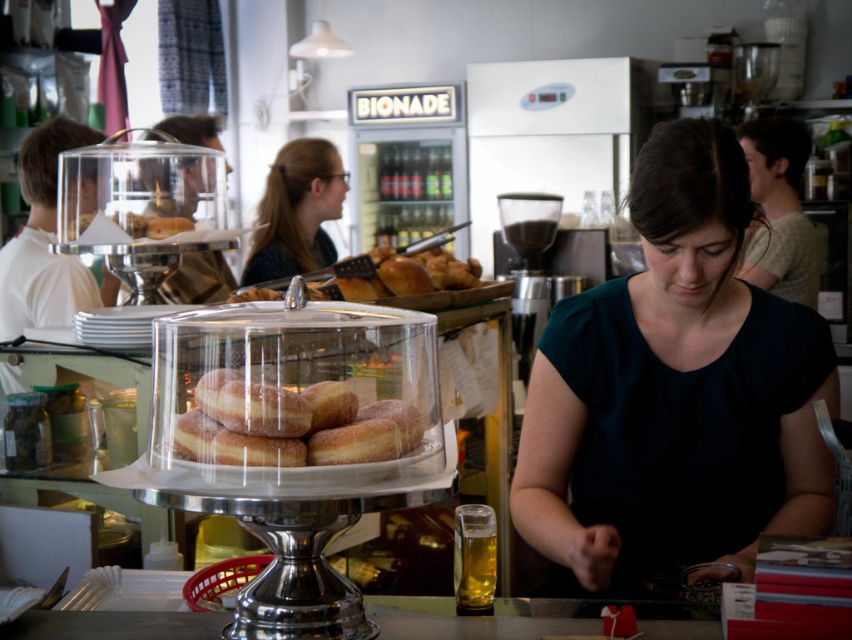
Question: Is dark green blouse at center below matte black shirt at center?

Choices:
 (A) no
 (B) yes

Answer: (B)

Question: Which object is positioned farthest from the sugared doughnut at center?

Choices:
 (A) light beige shirt at upper right
 (B) sugared doughnuts at center

Answer: (A)

Question: Does sugared doughnuts at center have a greater width compared to light beige shirt at upper right?

Choices:
 (A) no
 (B) yes

Answer: (A)

Question: Which of the following is the farthest from the observer?

Choices:
 (A) (389, 438)
 (B) (325, 243)

Answer: (B)

Question: Is the position of matte black shirt at center less distant than that of sugared doughnut at center?

Choices:
 (A) no
 (B) yes

Answer: (A)

Question: Which point is farther from the camera taking this photo?

Choices:
 (A) (366, 432)
 (B) (671, 440)
 (C) (780, 212)

Answer: (C)